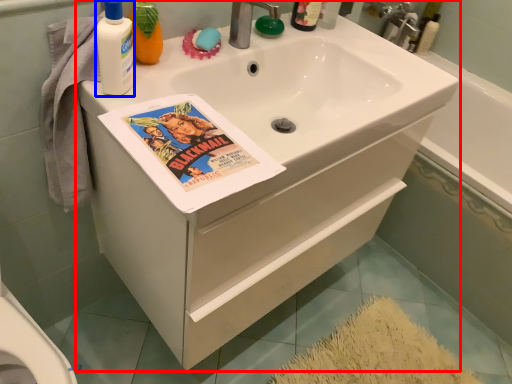
Question: Which object is further to the camera taking this photo, bathroom cabinet (highlighted by a red box) or cleaning product (highlighted by a blue box)?

Choices:
 (A) bathroom cabinet
 (B) cleaning product

Answer: (A)